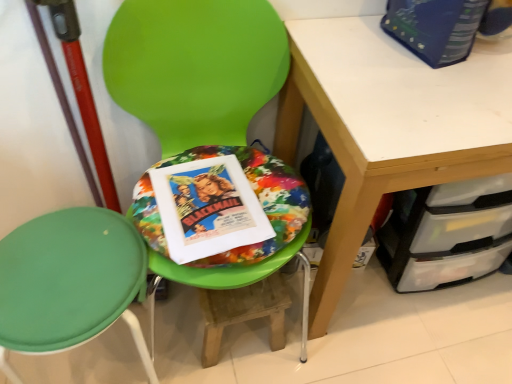
At what (x,y) coordinates should I click in order to perform the action: click on vacant area situated to the left side of blue cardboard book at upper right, marked as the 1th paperback book in a top-to-bottom arrangement. Please return your answer as a coordinate pair (x, y). Looking at the image, I should click on (350, 43).